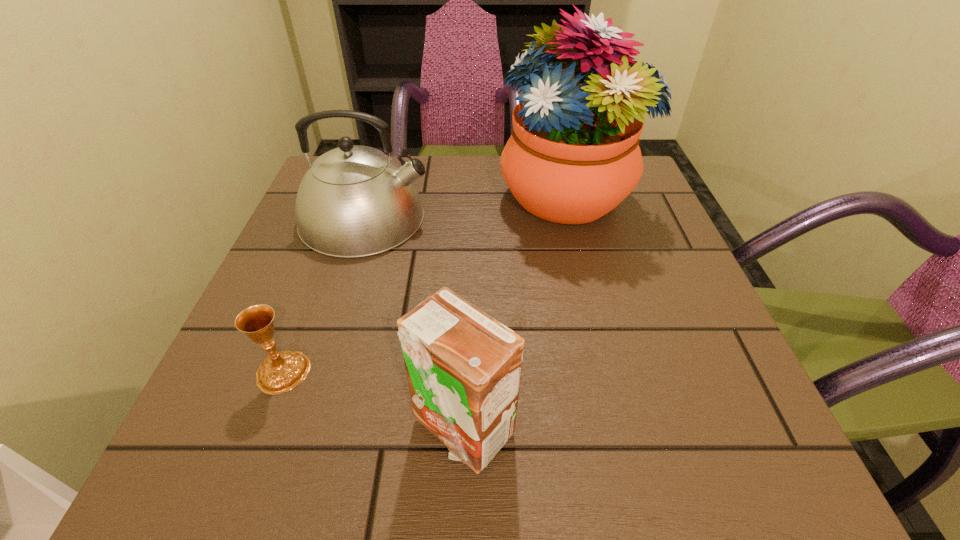
Where is `kettle that is at the left edge`? kettle that is at the left edge is located at coordinates (354, 201).

Identify the location of chalice present at the left edge. This screenshot has width=960, height=540. pos(279,372).

The width and height of the screenshot is (960, 540). Identify the location of object located in the right edge section of the desktop. (573, 156).

Where is `object positioned at the far left corner`? object positioned at the far left corner is located at coordinates (354, 201).

The width and height of the screenshot is (960, 540). Identify the location of object situated at the far right corner. (573, 156).

At what (x,y) coordinates should I click in order to perform the action: click on free space at the far edge of the desktop. Please return your answer as a coordinate pair (x, y). The width and height of the screenshot is (960, 540). Looking at the image, I should click on (472, 202).

The width and height of the screenshot is (960, 540). In order to click on free region at the near edge in this screenshot , I will do `click(401, 462)`.

In the image, there is a desktop. Identify the location of vacant region at the left edge. (338, 327).

Locate an element on the screen. Image resolution: width=960 pixels, height=540 pixels. vacant space at the right edge of the desktop is located at coordinates (616, 233).

Image resolution: width=960 pixels, height=540 pixels. Identify the location of vacant space that's between the carton and the chalice. (372, 399).